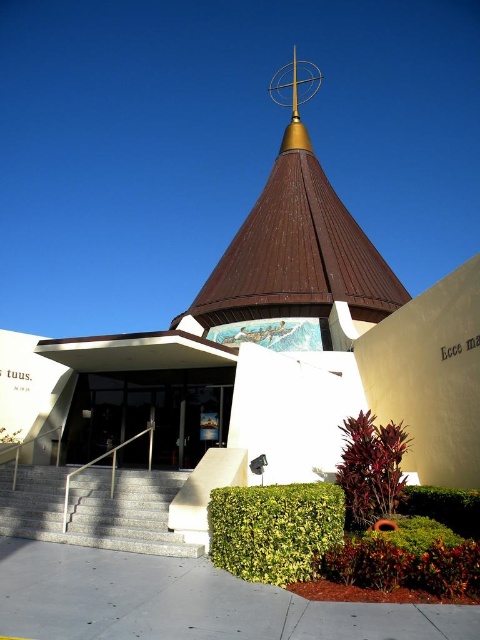
You are standing at the bottom of the gray stone steps leading to the entrance. You want to place a new decorative flagpole in front of the building so that it is visible from the glass door. Where should you place the flagpole relative to the brown metallic spire at center and the dark red leafy plant at lower center?

The brown metallic spire at center is located above the dark red leafy plant at lower center. To ensure visibility from the glass door, place the flagpole in front of the dark red leafy plant at lower center so it is positioned below the brown metallic spire at center and in the line of sight from the entrance.

You are standing in front of the modern building and want to locate two specific points marked on the structure. The first point is at coordinates point (284, 528) and the second is at point (375, 426). Which point is closer to you?

Point (284, 528) is closer to the viewer than point (375, 426).